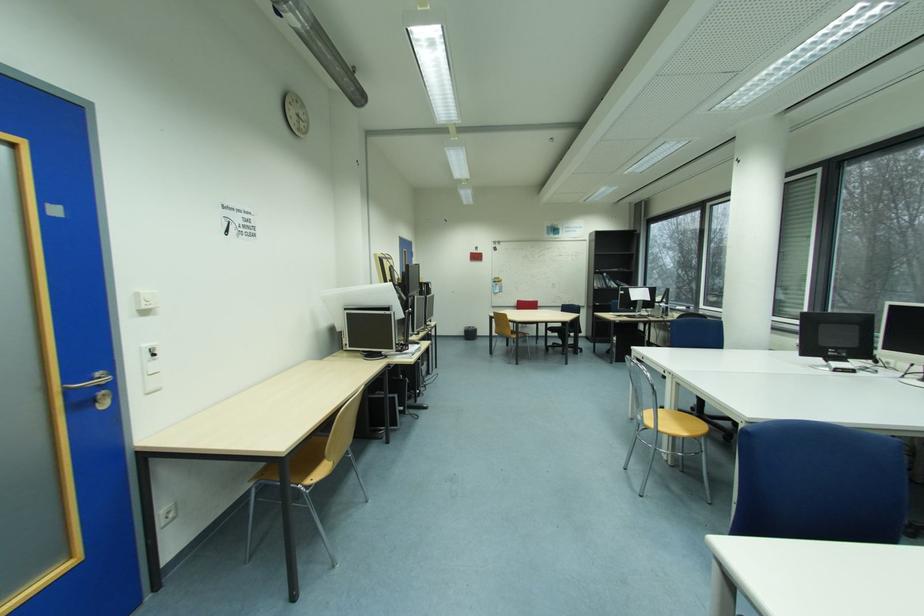
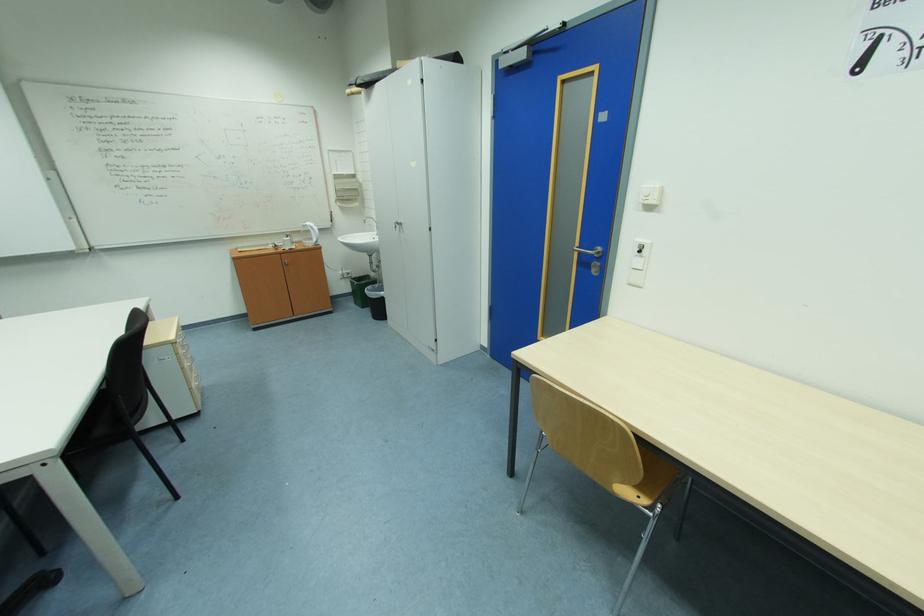
Where in the second image is the point corresponding to point 76,392 from the first image?

(587, 253)